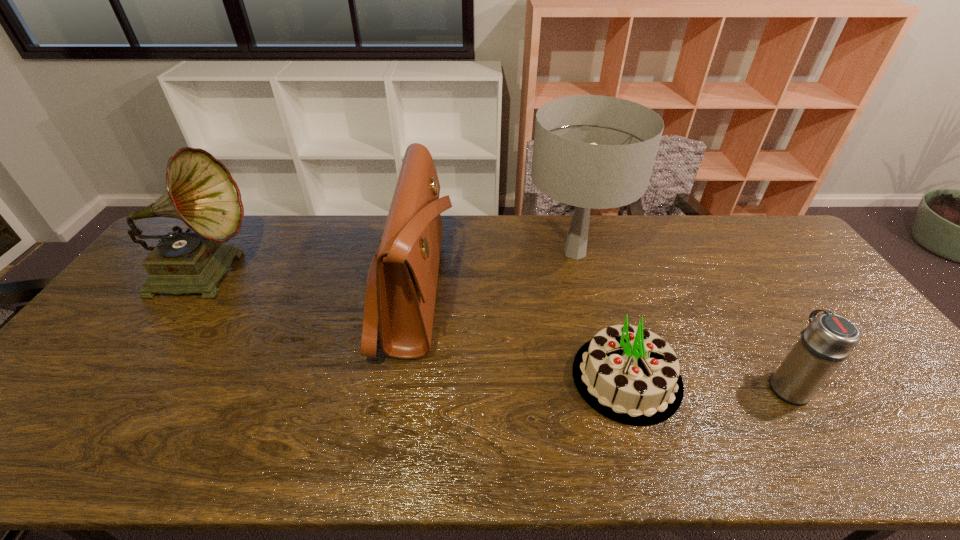
Image resolution: width=960 pixels, height=540 pixels. Identify the location of vacant space at the right edge of the desktop. (907, 410).

At what (x,y) coordinates should I click in order to perform the action: click on vacant space at the far right corner of the desktop. Please return your answer as a coordinate pair (x, y). Looking at the image, I should click on tap(778, 256).

This screenshot has width=960, height=540. Identify the location of vacant region between the rightmost object and the lampshade. (681, 319).

Find the location of `empty space between the lampshade and the second shortest object`. empty space between the lampshade and the second shortest object is located at coordinates (681, 319).

At what (x,y) coordinates should I click in order to perform the action: click on unoccupied area between the lampshade and the thermos bottle. Please return your answer as a coordinate pair (x, y). The width and height of the screenshot is (960, 540). Looking at the image, I should click on (681, 319).

Identify the location of unoccupied position between the thermos bottle and the lampshade. The width and height of the screenshot is (960, 540). [681, 319].

This screenshot has width=960, height=540. I want to click on free spot between the lampshade and the fourth object from right to left, so click(493, 271).

The image size is (960, 540). I want to click on free point between the shortest object and the satchel, so click(519, 334).

At what (x,y) coordinates should I click in order to perform the action: click on empty location between the shortest object and the fourth object from right to left. Please return your answer as a coordinate pair (x, y). This screenshot has height=540, width=960. Looking at the image, I should click on (519, 334).

Image resolution: width=960 pixels, height=540 pixels. What are the coordinates of `vacant space that's between the thermos bottle and the record player` in the screenshot? It's located at (496, 329).